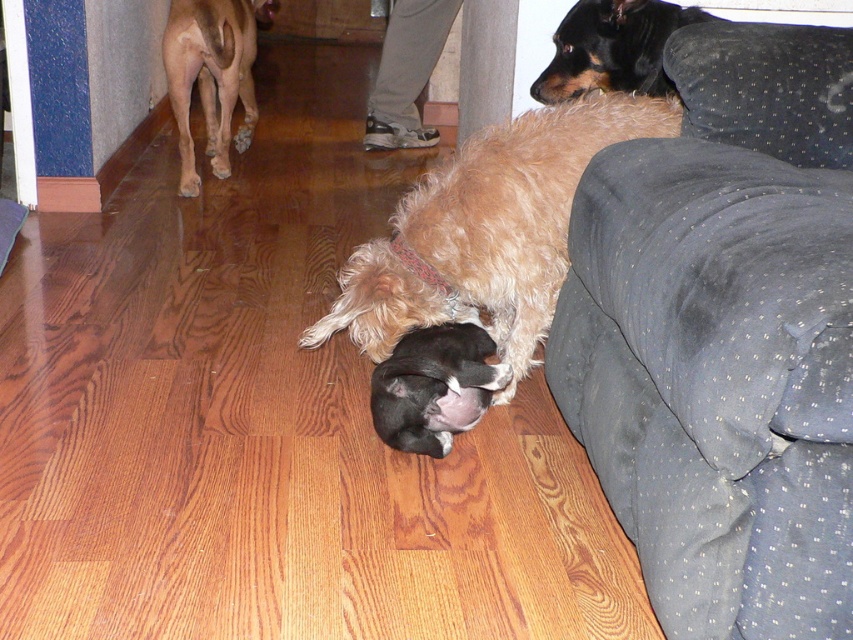
Is fuzzy brown dog at center below smooth tan dog at upper left?

Yes, fuzzy brown dog at center is below smooth tan dog at upper left.

Which is in front, point (613, 106) or point (218, 92)?

Point (613, 106) is more forward.

Where is `fuzzy brown dog at center`? The image size is (853, 640). fuzzy brown dog at center is located at coordinates (486, 230).

Is black fur at center to the right of black smooth dog at upper right from the viewer's perspective?

No, black fur at center is not to the right of black smooth dog at upper right.

Can you confirm if black fur at center is taller than black smooth dog at upper right?

In fact, black fur at center may be shorter than black smooth dog at upper right.

Who is more distant from viewer, (432, 328) or (587, 33)?

Positioned behind is point (587, 33).

The image size is (853, 640). What are the coordinates of `black fur at center` in the screenshot? It's located at (434, 387).

Can you confirm if smooth tan dog at upper left is positioned above black smooth dog at upper right?

Yes, smooth tan dog at upper left is above black smooth dog at upper right.

Where is `smooth tan dog at upper left`? Image resolution: width=853 pixels, height=640 pixels. smooth tan dog at upper left is located at coordinates (210, 76).

Where is `smooth tan dog at upper left`? The height and width of the screenshot is (640, 853). smooth tan dog at upper left is located at coordinates (210, 76).